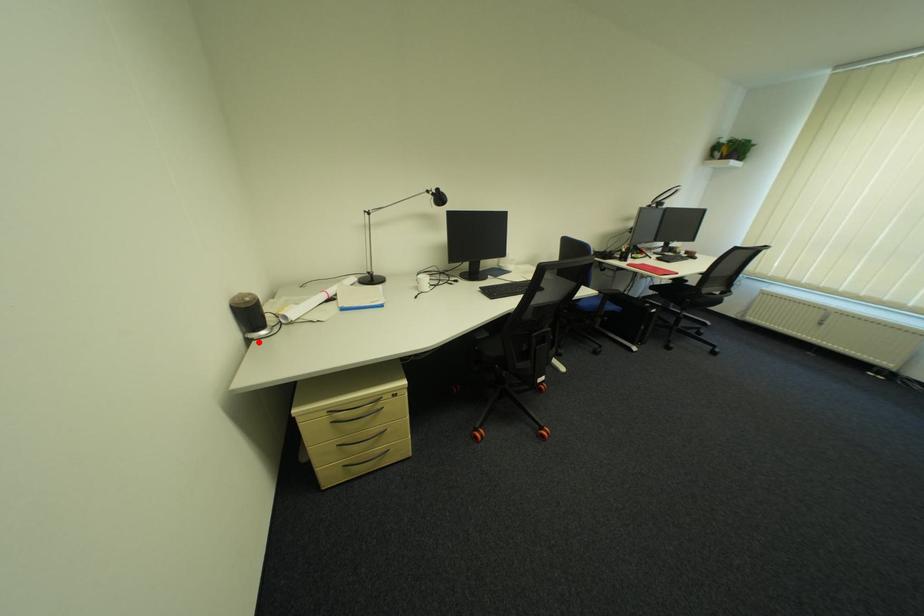
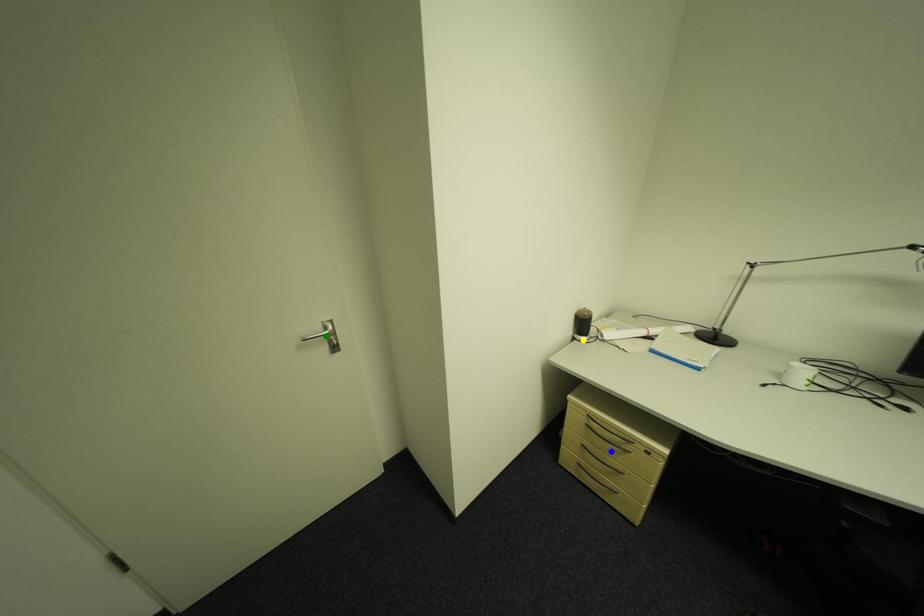
Question: I am providing you with two images of the same scene from different viewpoints. A red point is marked on the first image. You are given multiple points on the second image. Which mark in image 2 goes with the point in image 1?

Choices:
 (A) green point
 (B) yellow point
 (C) blue point

Answer: (B)